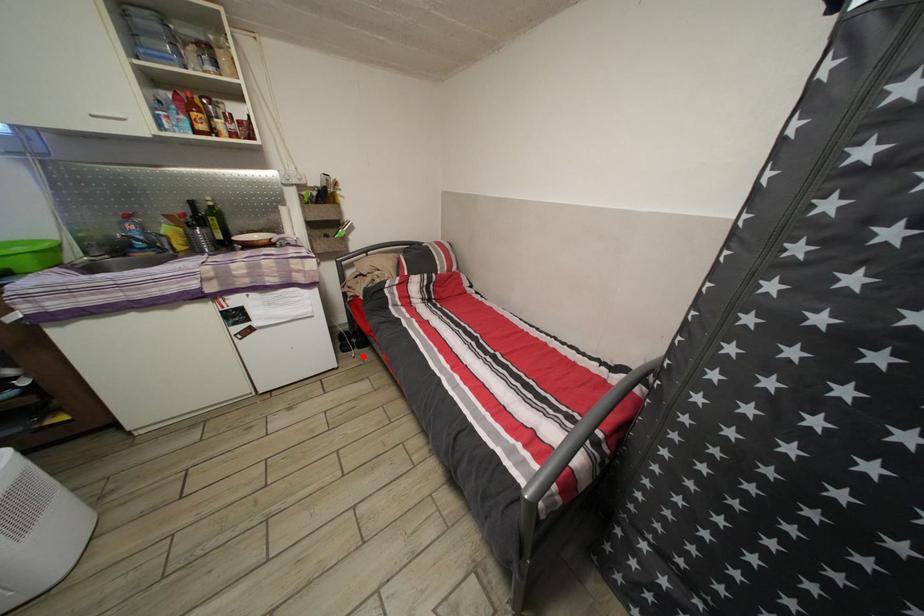
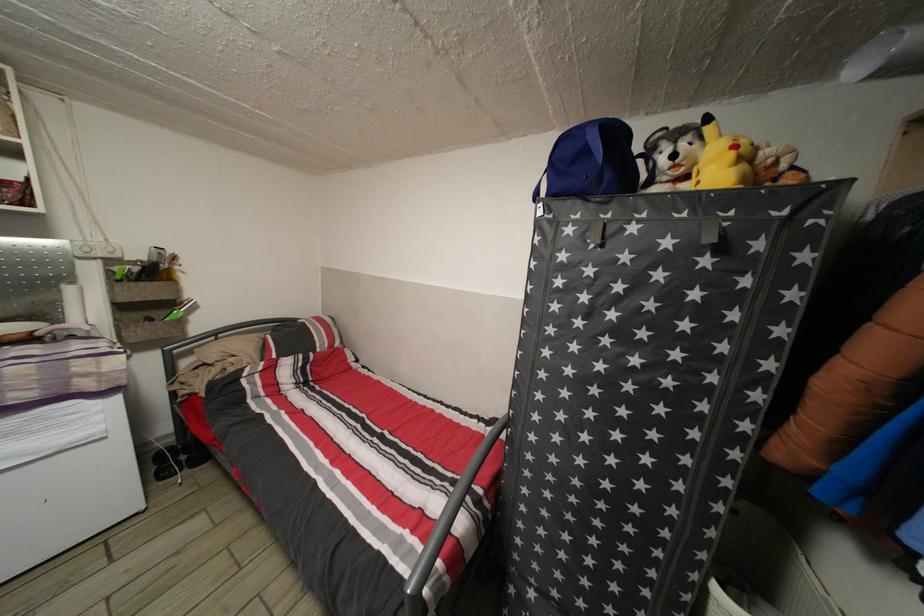
In the second image, find the point that corresponds to the highlighted location in the first image.

(192, 477)